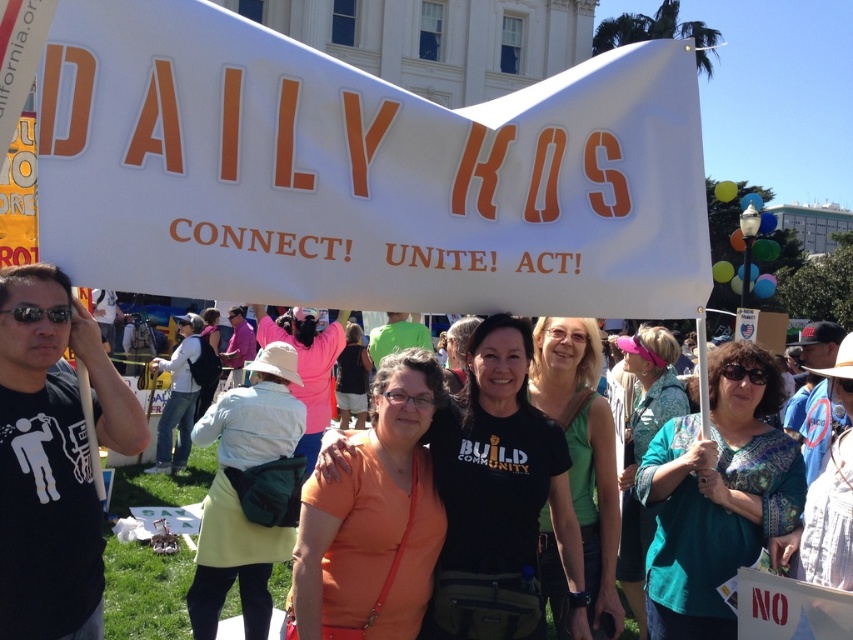
Question: Among these points, which one is nearest to the camera?

Choices:
 (A) (426, 556)
 (B) (630, 413)
 (C) (169, 368)
 (D) (339, 356)

Answer: (A)

Question: Which of the following is the farthest from the observer?

Choices:
 (A) green matte tank top at center
 (B) teal fabric shirt at center
 (C) light green skirt at center

Answer: (C)

Question: Can you confirm if teal printed blouse at center is thinner than white cotton shirt at center?

Choices:
 (A) yes
 (B) no

Answer: (B)

Question: Does orange fabric shirt at center appear on the left side of white cotton shirt at center?

Choices:
 (A) yes
 (B) no

Answer: (B)

Question: Can you confirm if orange matte shirt at center is positioned to the right of matte black shirt at center?

Choices:
 (A) yes
 (B) no

Answer: (A)

Question: Which object is closer to the camera taking this photo?

Choices:
 (A) matte black shirt at center
 (B) orange fabric shirt at center
 (C) orange matte shirt at center

Answer: (C)